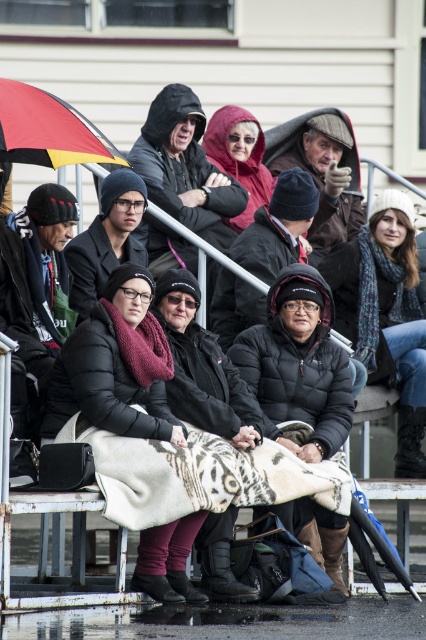
Question: Does black quilted jacket at lower center have a lesser width compared to red/yellow striped umbrella at upper left?

Choices:
 (A) no
 (B) yes

Answer: (B)

Question: Does black quilted jacket at lower center come behind red/yellow striped umbrella at upper left?

Choices:
 (A) no
 (B) yes

Answer: (B)

Question: Which point appears closest to the camera in this image?

Choices:
 (A) click(x=287, y=371)
 (B) click(x=40, y=164)

Answer: (A)

Question: Which point is closer to the camera?

Choices:
 (A) black quilted jacket at lower center
 (B) red/yellow striped umbrella at upper left

Answer: (B)

Question: From the image, what is the correct spatial relationship of black quilted jacket at lower center in relation to red/yellow striped umbrella at upper left?

Choices:
 (A) below
 (B) above

Answer: (A)